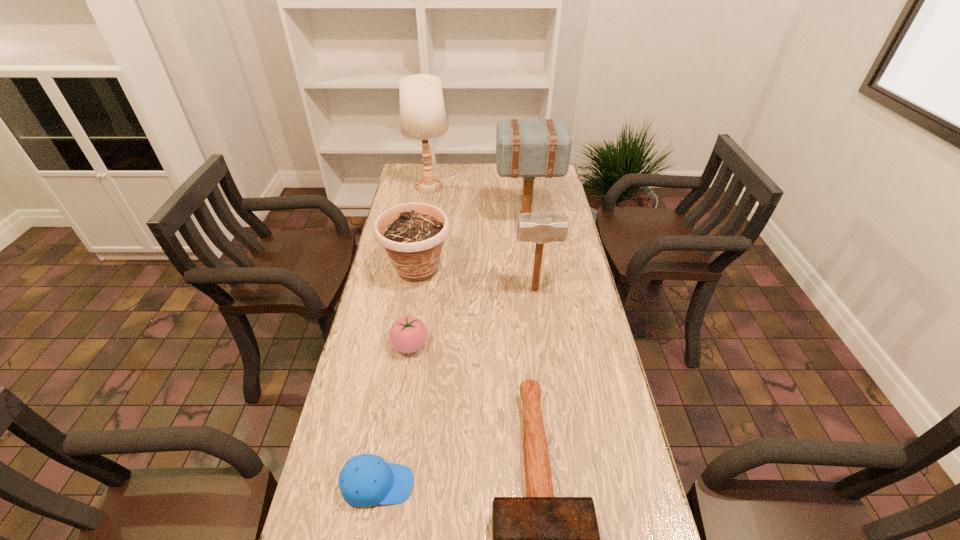
This screenshot has height=540, width=960. Identify the location of lamp. (422, 113).

Identify the location of the farthest object. (422, 113).

Find the location of `the farthest mallet`. the farthest mallet is located at coordinates (528, 149).

Where is `the second tallest object`? the second tallest object is located at coordinates (528, 149).

Where is `the fifth shortest object`? The width and height of the screenshot is (960, 540). the fifth shortest object is located at coordinates (541, 227).

This screenshot has width=960, height=540. Identify the location of the second farthest mallet. (541, 227).

This screenshot has height=540, width=960. I want to click on flowerpot, so click(x=413, y=234).

The width and height of the screenshot is (960, 540). In order to click on tomato in this screenshot , I will do coord(408,334).

I want to click on the third shortest object, so click(408, 334).

This screenshot has width=960, height=540. In order to click on cap in this screenshot , I will do `click(365, 480)`.